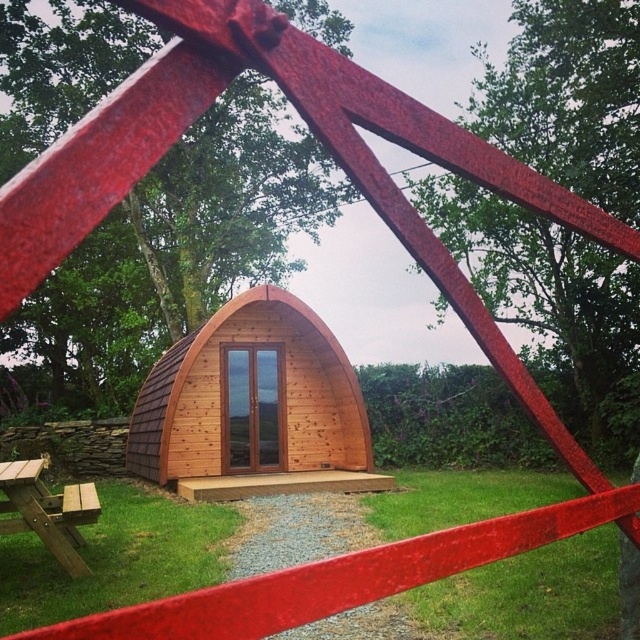
How distant is wooden cabin at center from wooden picnic table at lower left?

wooden cabin at center is 5.40 meters away from wooden picnic table at lower left.

Does wooden cabin at center appear on the left side of wooden picnic table at lower left?

No, wooden cabin at center is not to the left of wooden picnic table at lower left.

Where is `wooden cabin at center`? The width and height of the screenshot is (640, 640). wooden cabin at center is located at coordinates (253, 406).